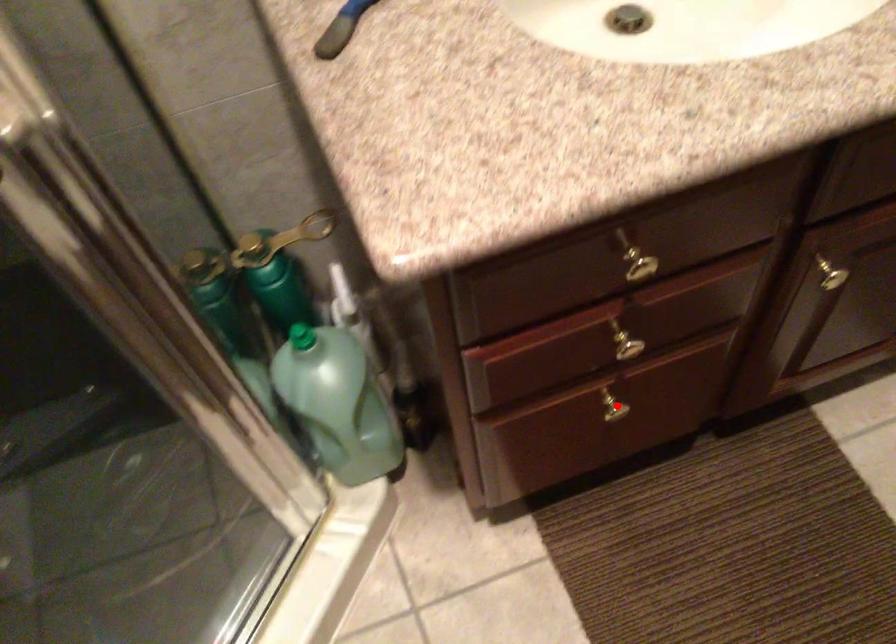
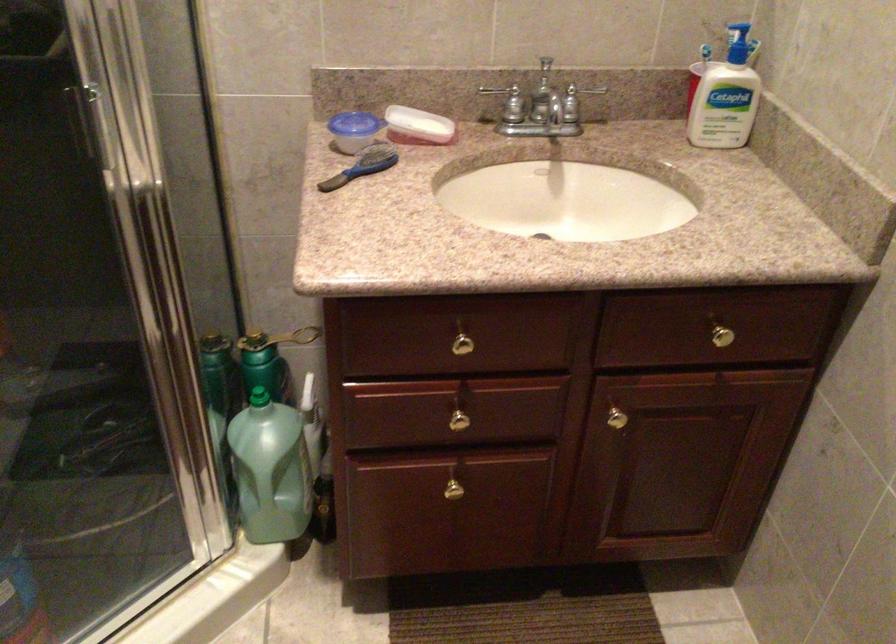
In the second image, find the point that corresponds to the highlighted location in the first image.

(455, 488)